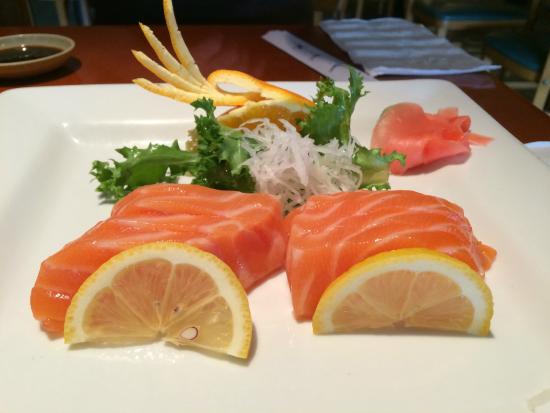
Locate an element on the screen. This screenshot has width=550, height=413. white plate is located at coordinates (354, 381).